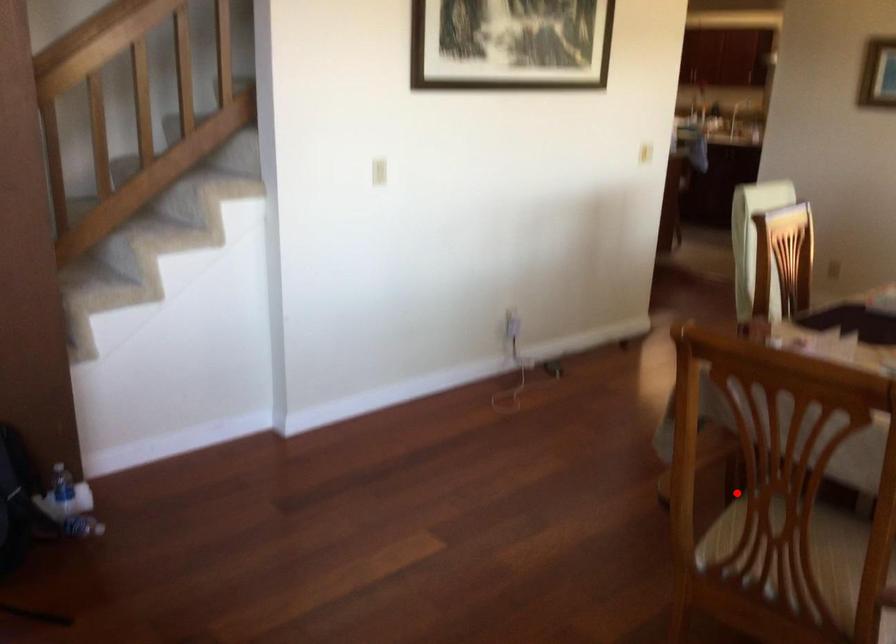
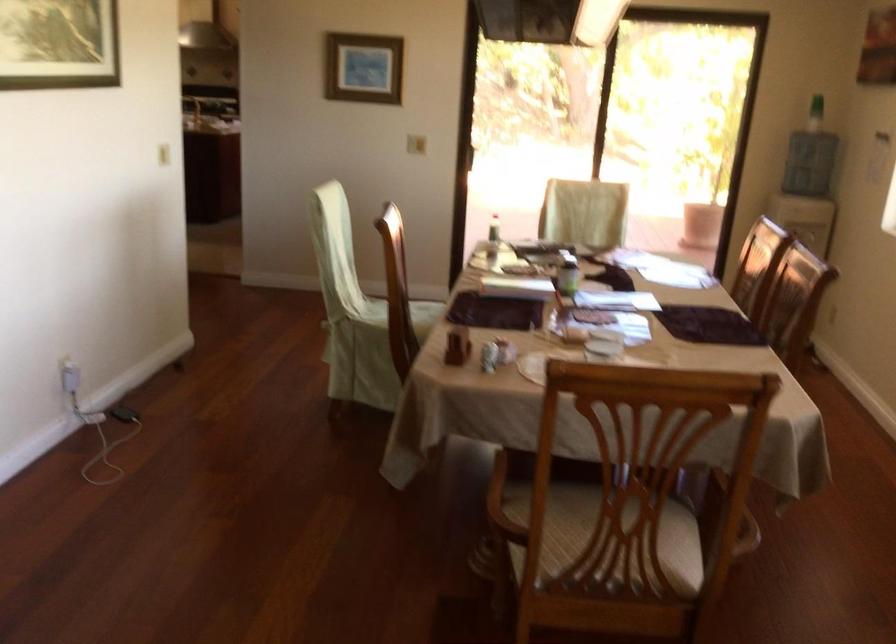
Find the pixel in the second image that matches the highlighted location in the first image.

(503, 504)